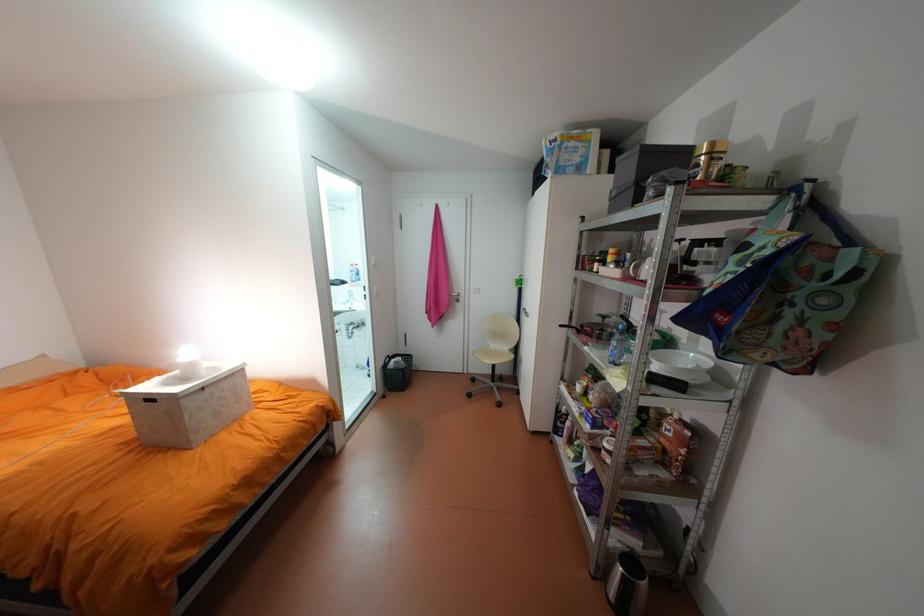
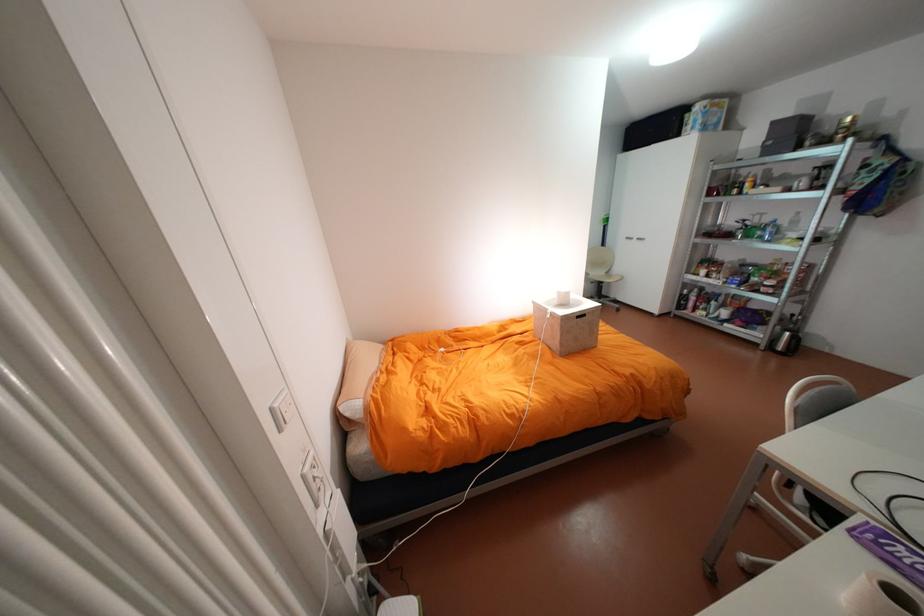
Question: Which direction would the cameraman need to move to produce the second image? Reply with the corresponding letter.

Choices:
 (A) Left
 (B) Right
 (C) Forward
 (D) Backward

Answer: (A)